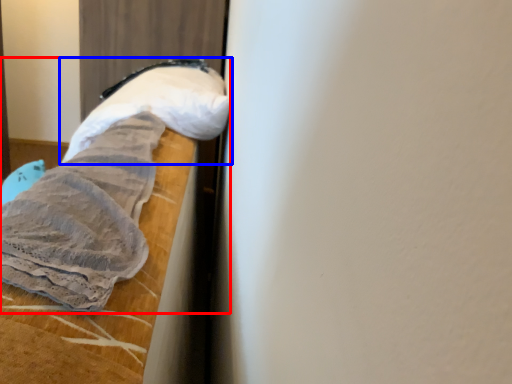
Question: Which of the following is the closest to the observer, sheet (highlighted by a red box) or footwear (highlighted by a blue box)?

Choices:
 (A) sheet
 (B) footwear

Answer: (A)